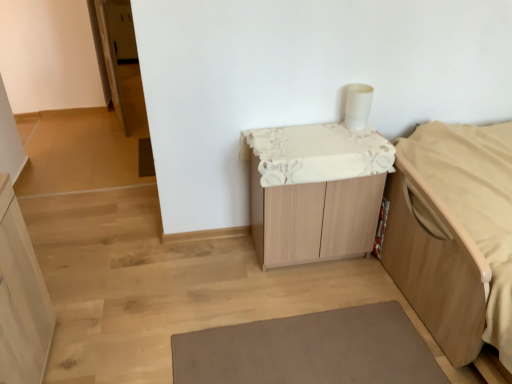
Question: Is light wood bed frame at right directly adjacent to wooden cabinet at center?

Choices:
 (A) no
 (B) yes

Answer: (A)

Question: Does light wood bed frame at right turn towards wooden cabinet at center?

Choices:
 (A) yes
 (B) no

Answer: (B)

Question: Can you confirm if light wood bed frame at right is bigger than wooden cabinet at center?

Choices:
 (A) yes
 (B) no

Answer: (A)

Question: Does light wood bed frame at right have a lesser height compared to wooden cabinet at center?

Choices:
 (A) no
 (B) yes

Answer: (B)

Question: Is light wood bed frame at right at the left side of wooden cabinet at center?

Choices:
 (A) no
 (B) yes

Answer: (A)

Question: Is light wood bed frame at right looking in the opposite direction of wooden cabinet at center?

Choices:
 (A) yes
 (B) no

Answer: (B)

Question: Is light wood cabinet at left surrounding wooden cabinet at center?

Choices:
 (A) no
 (B) yes

Answer: (A)

Question: Could you tell me if light wood cabinet at left is facing wooden cabinet at center?

Choices:
 (A) yes
 (B) no

Answer: (A)

Question: Is light wood cabinet at left located outside wooden cabinet at center?

Choices:
 (A) yes
 (B) no

Answer: (A)

Question: From the image's perspective, is light wood cabinet at left located beneath wooden cabinet at center?

Choices:
 (A) yes
 (B) no

Answer: (A)

Question: Can you confirm if light wood cabinet at left is wider than wooden cabinet at center?

Choices:
 (A) no
 (B) yes

Answer: (A)

Question: From the image's perspective, is light wood cabinet at left located above wooden cabinet at center?

Choices:
 (A) yes
 (B) no

Answer: (B)

Question: Is light wood cabinet at left bigger than light wood bed frame at right?

Choices:
 (A) yes
 (B) no

Answer: (B)